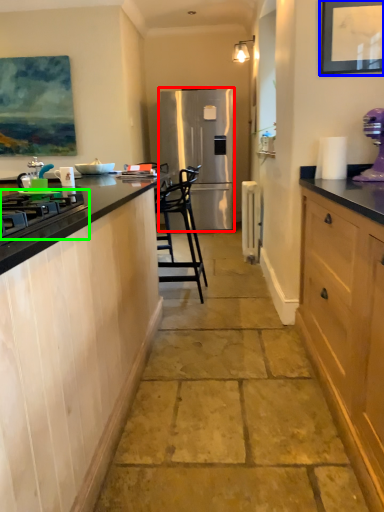
Question: Which is farther away from refrigerator (highlighted by a red box)? picture frame (highlighted by a blue box) or gas stove (highlighted by a green box)?

Choices:
 (A) picture frame
 (B) gas stove

Answer: (B)